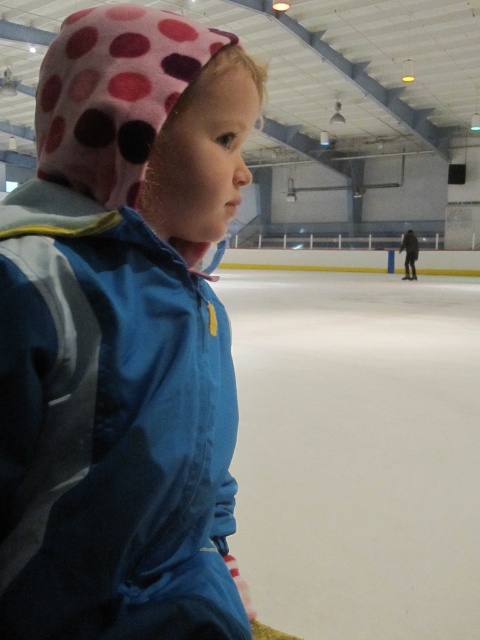
You are at the ice rink and want to locate the blue fabric jacket at left. According to the coordinates provided, where should you look to find it?

The blue fabric jacket at left is located at point 0.658 on the x axis and 0.225 on the y axis.

You are a photographer trying to capture the child in the blue fabric jacket at left and the white smooth ice at center. From your current position, which object is closer to you?

The blue fabric jacket at left is closer to you because it is positioned in front of the white smooth ice at center.

You are a photographer setting up a shot of the blue fabric jacket at left and the white smooth ice at center. Which object should you focus on first if you want to capture both in one frame without moving the camera?

The blue fabric jacket at left is shorter than the white smooth ice at center, so you should focus on the blue fabric jacket at left first to ensure both are in focus since it is closer to the camera.